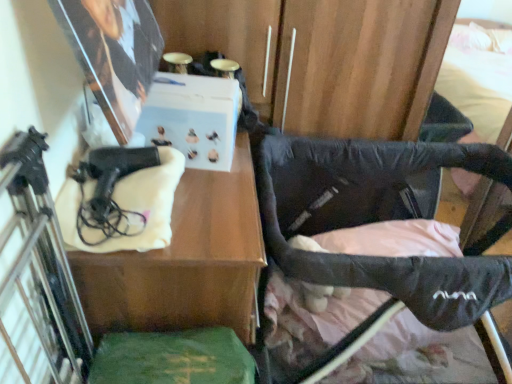
This screenshot has width=512, height=384. I want to click on free point above green felt book at lower center (from a real-world perspective), so click(x=175, y=356).